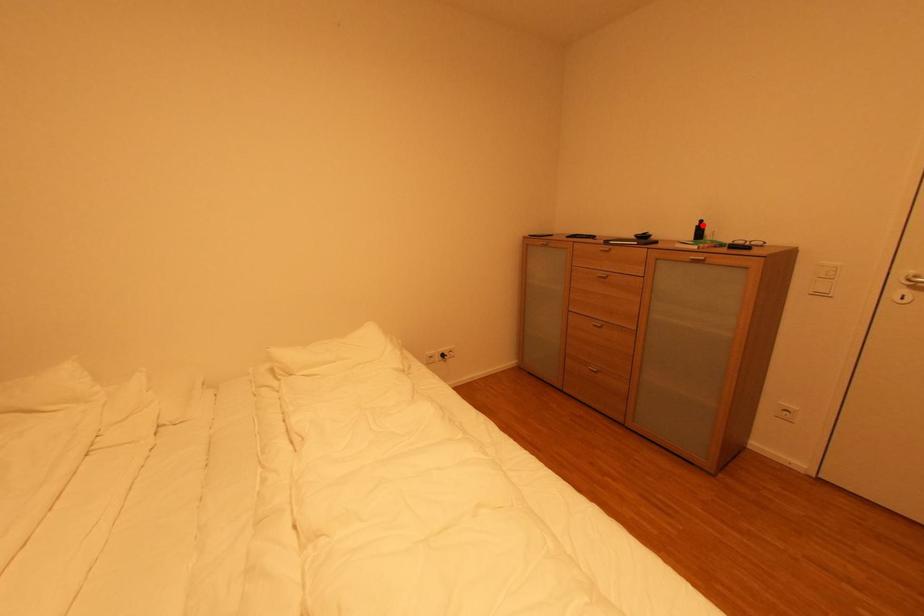
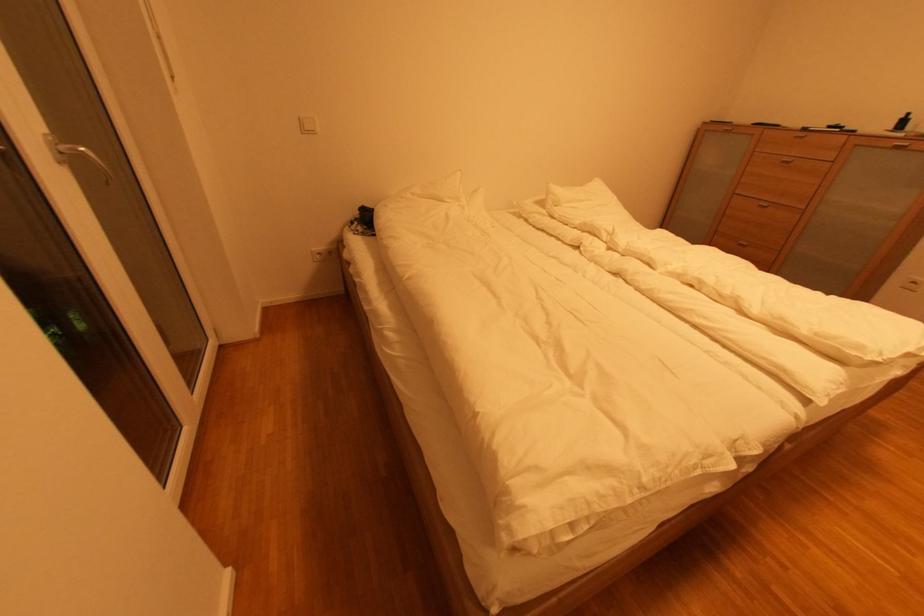
Question: A red point is marked in image1. In image2, is the corresponding 3D point closer to the camera or farther? Reply with the corresponding letter.

Choices:
 (A) The corresponding 3D point is closer.
 (B) The corresponding 3D point is farther.

Answer: (B)